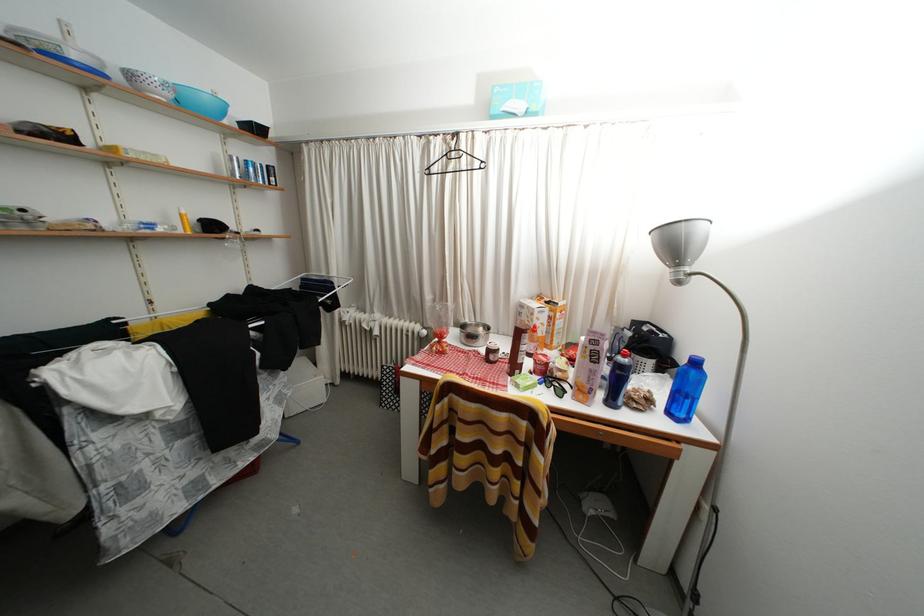
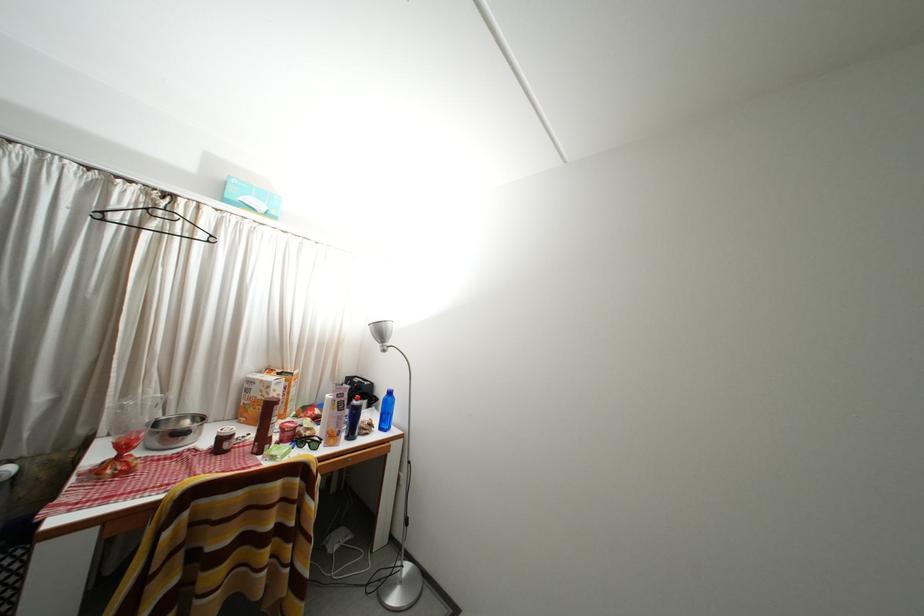
Question: The first image is from the beginning of the video and the second image is from the end. How did the camera likely rotate when shooting the video?

Choices:
 (A) Left
 (B) Right
 (C) Up
 (D) Down

Answer: (B)